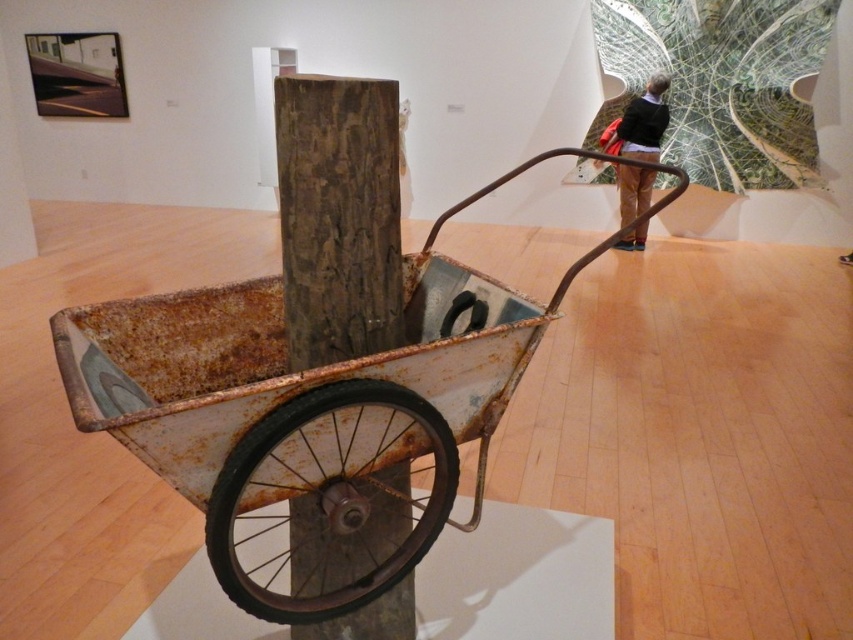
You are standing in the gallery looking at the art installation. There are two points marked on the wall. The first point is at coordinates point (97, 349) and the second point is at point (234, 445). Which point is closer to you?

Point (97, 349) is further to the camera than point (234, 445), so the second point is closer to you.

You are standing in the gallery and want to take a photo of the wheelbarrow on the pedestal. The gallery has a rule that you must stand at least 6 feet away from any artwork. Is the point where you are standing, point (462, 292), compliant with the gallery rule?

The distance of point (462, 292) from the camera is 6.56 feet, which is more than the required 6 feet distance. Therefore, standing at point (462, 292) complies with the gallery rule.